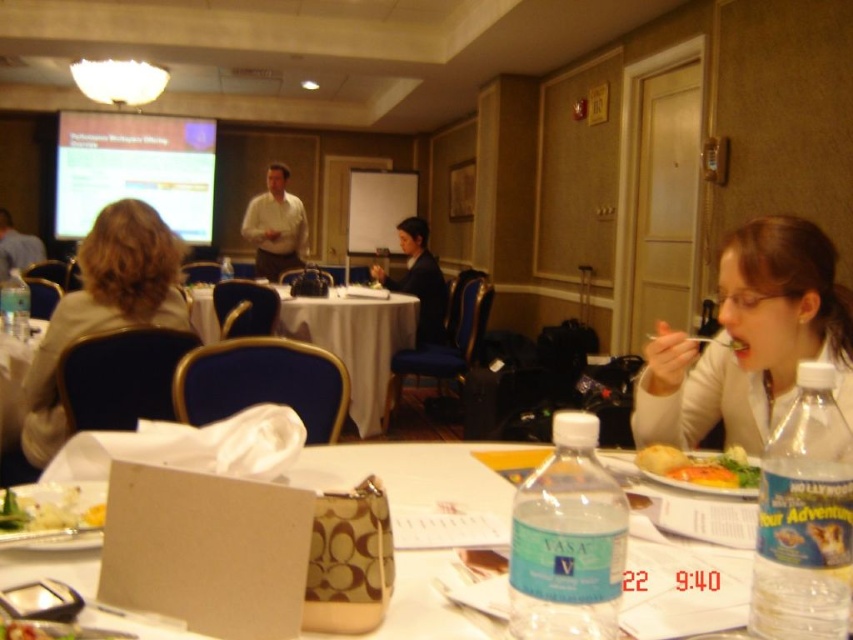
Question: Which object appears farthest from the camera in this image?

Choices:
 (A) white cloth table at center
 (B) dark suit jacket at center

Answer: (B)

Question: Is white creamy salad at lower left below matte black jacket at upper left?

Choices:
 (A) yes
 (B) no

Answer: (A)

Question: Can you confirm if dark suit jacket at center is positioned to the left of matte black jacket at upper left?

Choices:
 (A) no
 (B) yes

Answer: (A)

Question: Which point appears closest to the camera in this image?

Choices:
 (A) (199, 243)
 (B) (753, 598)
 (C) (0, 232)

Answer: (B)

Question: Among these objects, which one is nearest to the camera?

Choices:
 (A) white cloth table at center
 (B) dark suit jacket at center
 (C) clear plastic water bottle at lower right
 (D) translucent plastic water bottle at lower right

Answer: (C)

Question: Is light beige jacket at upper left further to camera compared to matte white projector screen at upper left?

Choices:
 (A) no
 (B) yes

Answer: (A)